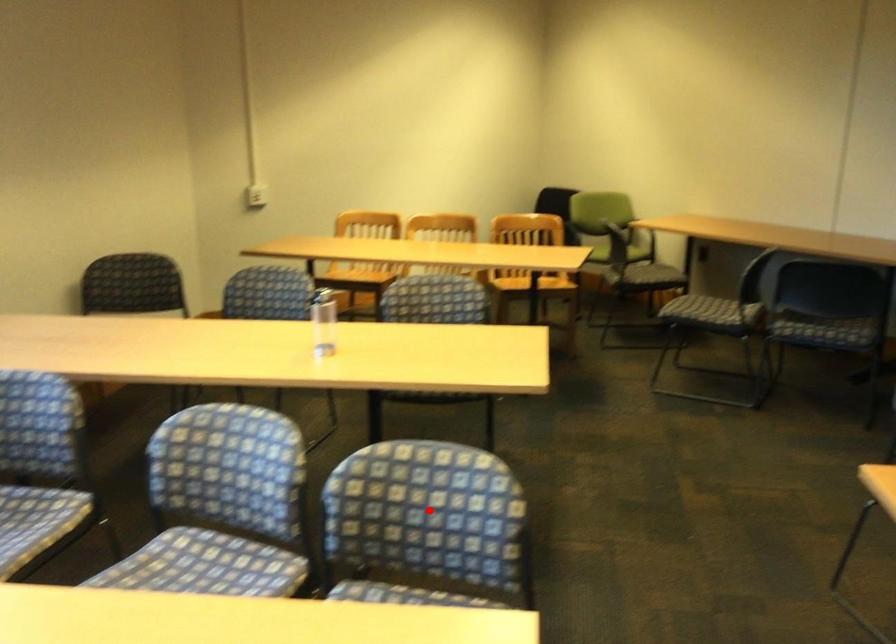
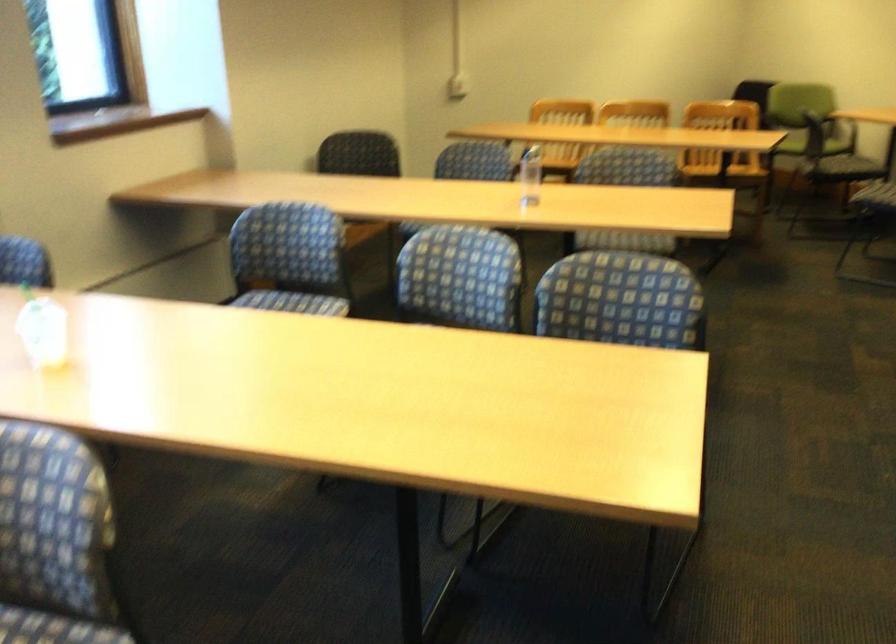
In the second image, find the point that corresponds to the highlighted location in the first image.

(622, 301)